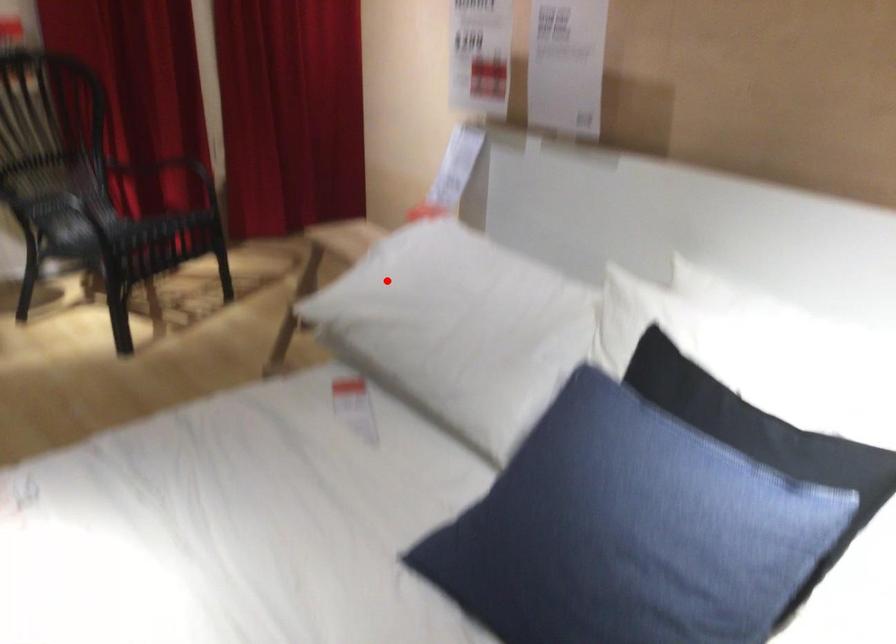
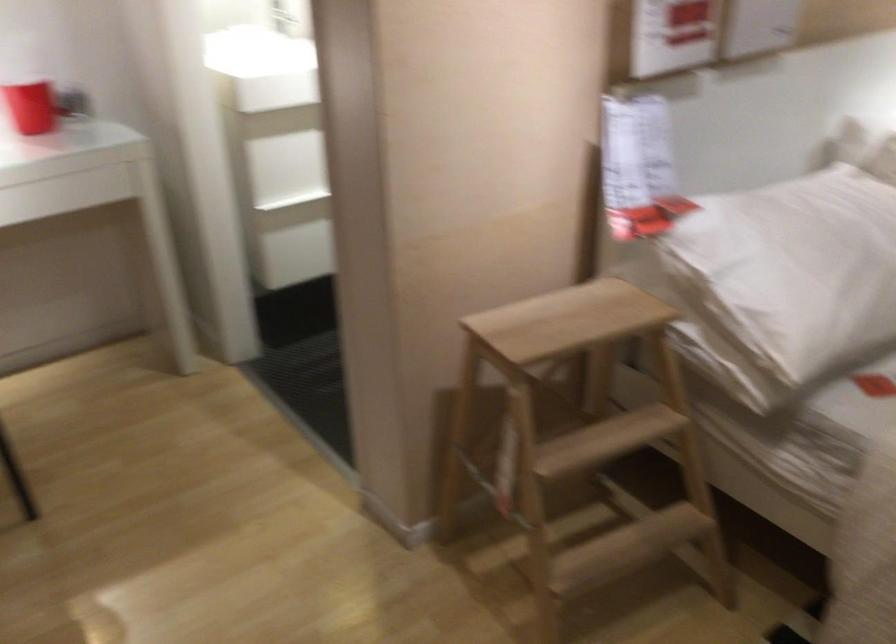
Find the pixel in the second image that matches the highlighted location in the first image.

(785, 281)